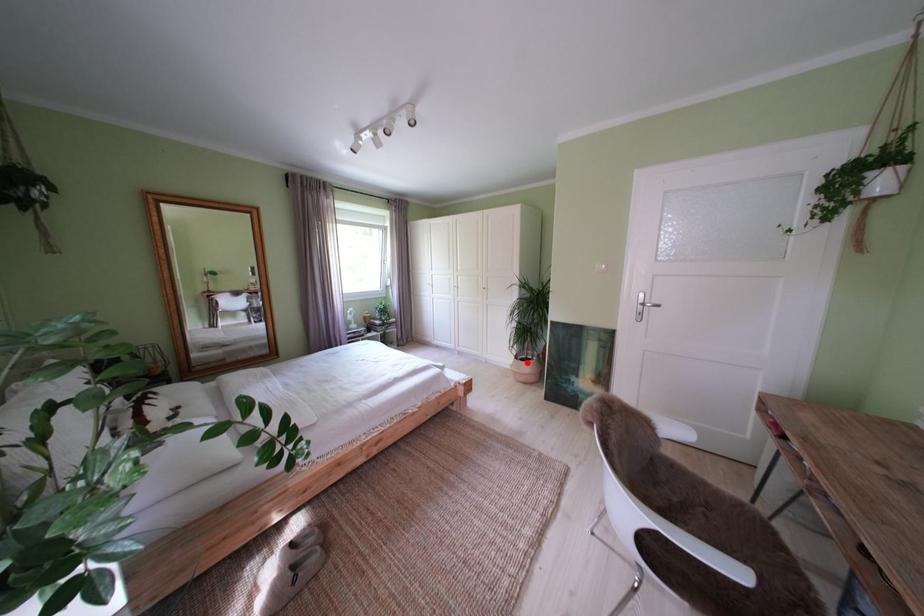
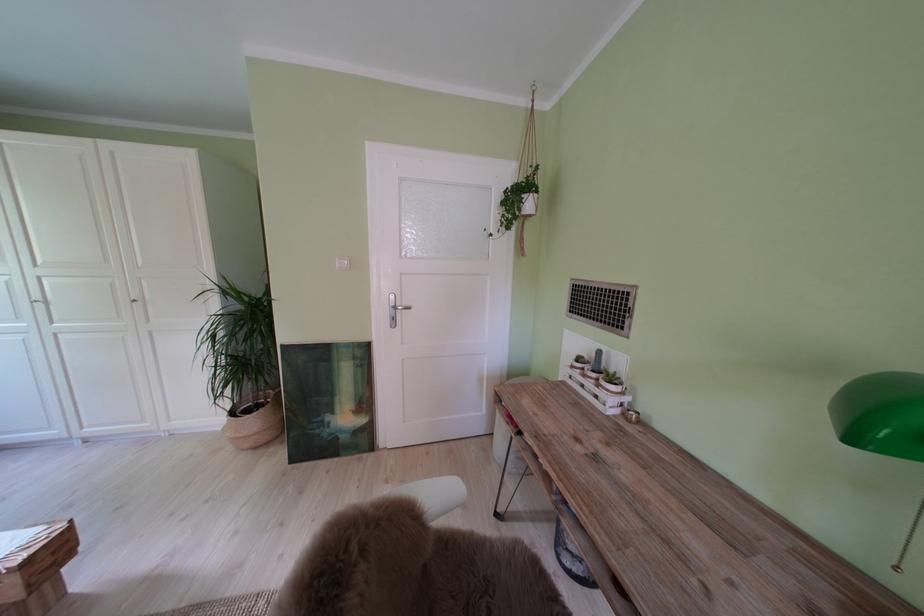
Find the pixel in the second image that matches the highlighted location in the first image.

(242, 418)